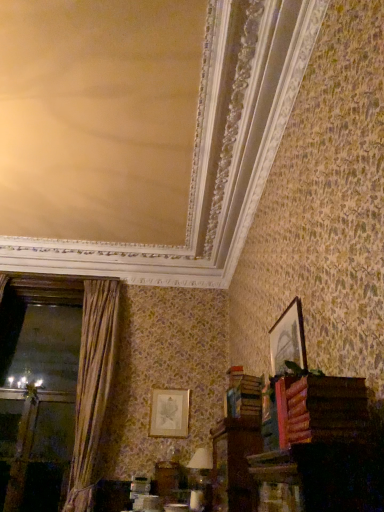
Question: Does point (208, 470) appear closer or farther from the camera than point (225, 400)?

Choices:
 (A) farther
 (B) closer

Answer: (A)

Question: From their relative heights in the image, would you say white paper at lower center is taller or shorter than wooden book at lower right, the 2th book from the front?

Choices:
 (A) short
 (B) tall

Answer: (B)

Question: Which of these objects is positioned farthest from the matte silver picture frame at center, which ranks as the 2th picture frame in right-to-left order?

Choices:
 (A) gold fabric curtain at left
 (B) white paper at lower center
 (C) wooden book at lower right, which ranks as the 1th book in bottom-to-top order
 (D) wooden picture frame at upper right, arranged as the first picture frame when viewed from the top
 (E) wooden book at lower right, the second book when ordered from back to front

Answer: (E)

Question: Based on their relative distances, which object is farther from the white paper at lower center?

Choices:
 (A) wooden book at lower right, which is the 1th book from back to front
 (B) gold fabric curtain at left
 (C) wooden book at lower right, which ranks as the 1th book in front-to-back order
 (D) matte silver picture frame at center, which ranks as the 1th picture frame in left-to-right order
 (E) wooden picture frame at upper right, the first picture frame from the front

Answer: (C)